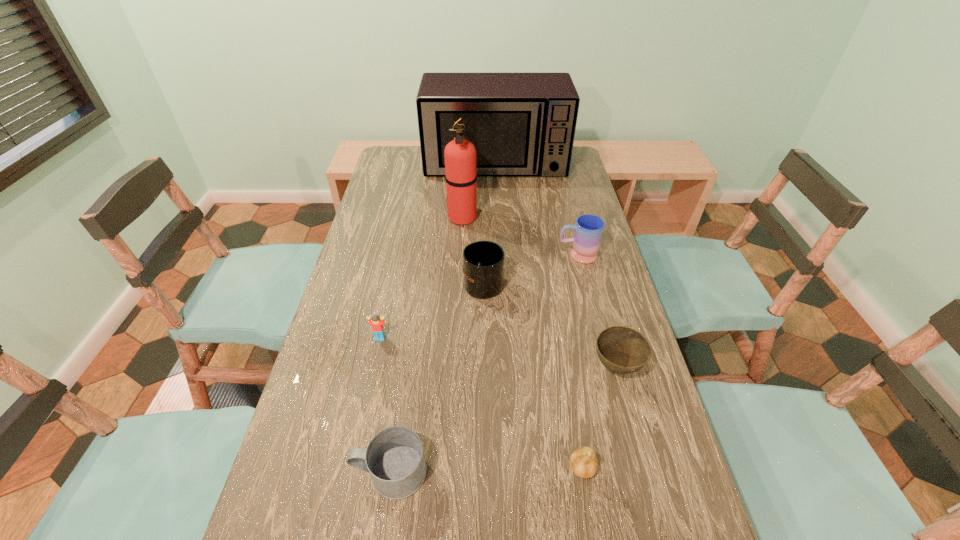
Locate an element on the screen. The image size is (960, 540). free location that satisfies the following two spatial constraints: 1. on the front-facing side of the farthest object; 2. on the side of the shortest mug with the handle is located at coordinates (511, 472).

In order to click on free space that satisfies the following two spatial constraints: 1. at the nozzle of the second farthest object; 2. with the handle on the side of the fourth farthest object in this screenshot , I will do `click(459, 282)`.

Image resolution: width=960 pixels, height=540 pixels. In order to click on free space that satisfies the following two spatial constraints: 1. on the face of the sixth farthest object; 2. on the left side of the Lego in this screenshot , I will do `click(373, 368)`.